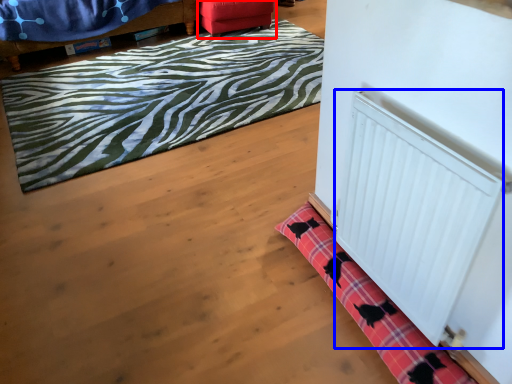
Question: Which object appears closest to the camera in this image, furniture (highlighted by a red box) or radiator (highlighted by a blue box)?

Choices:
 (A) furniture
 (B) radiator

Answer: (B)